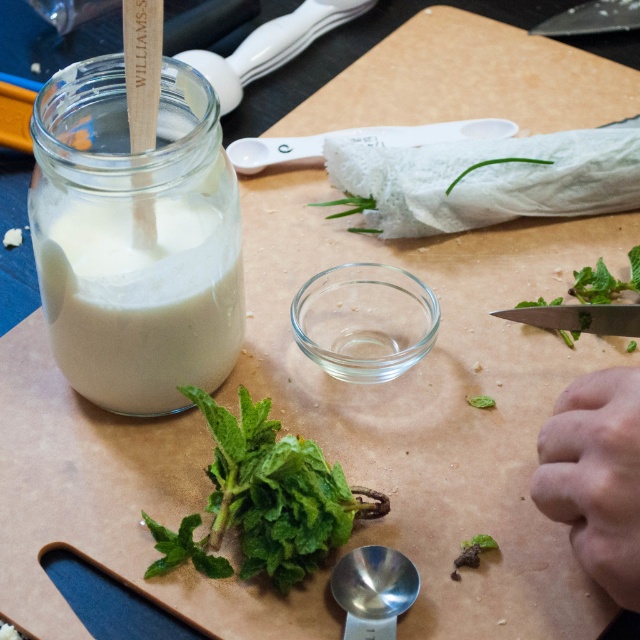
Question: Which object is farther from the camera taking this photo?

Choices:
 (A) green leafy spinach at lower left
 (B) fleshy skin hand at lower right
 (C) white matte jar at left

Answer: (C)

Question: Is white matte jar at left positioned at the back of fleshy skin hand at lower right?

Choices:
 (A) yes
 (B) no

Answer: (A)

Question: Is white matte jar at left closer to camera compared to fleshy skin hand at lower right?

Choices:
 (A) no
 (B) yes

Answer: (A)

Question: Which point appears farthest from the camera in this image?

Choices:
 (A) (564, 397)
 (B) (236, 257)

Answer: (B)

Question: Which object appears closest to the camera in this image?

Choices:
 (A) fleshy skin hand at lower right
 (B) green leafy spinach at lower left

Answer: (A)

Question: Is green leafy spinach at lower left closer to the viewer compared to fleshy skin hand at lower right?

Choices:
 (A) no
 (B) yes

Answer: (A)